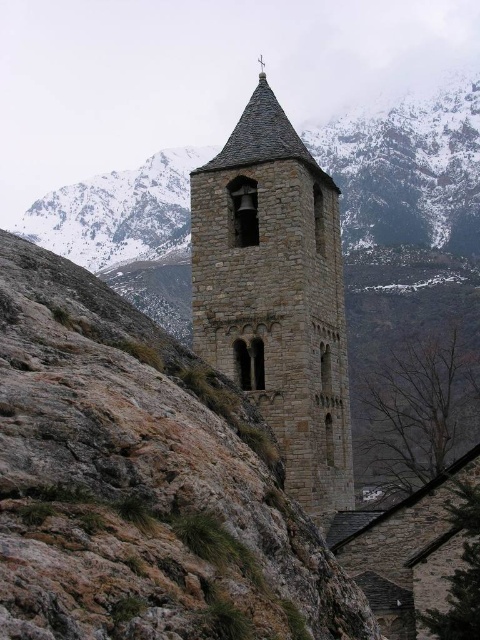
You are a hiker standing at the base of the gray stone mountain at center and want to reach the stone textured bell tower at center. Given that your average walking speed is 3 miles per hour, how long would it take you to reach the bell tower?

The distance between the gray stone mountain at center and the stone textured bell tower at center is 528.17 feet. Converting this distance to miles, it is approximately 0.1 miles. At a walking speed of 3 mph, it would take roughly 2 minutes to reach the bell tower.

You are a hiker planning to take a photo of the stone textured bell tower at center from the gray stone mountain at center. Considering their relative heights, will the bell tower be visible above the mountain when you stand at the mountain base?

The gray stone mountain at center is taller than the stone textured bell tower at center, so when standing at the mountain base, the bell tower will not be visible above the mountain.

You are a hiker planning to take a photo of the gray stone mountain at center and the stone textured bell tower at center. Which object should you focus on first if you want to capture both in a single frame without moving your camera?

You should focus on the gray stone mountain at center first because it is larger than the stone textured bell tower at center, allowing it to dominate the frame while still including the smaller bell tower.